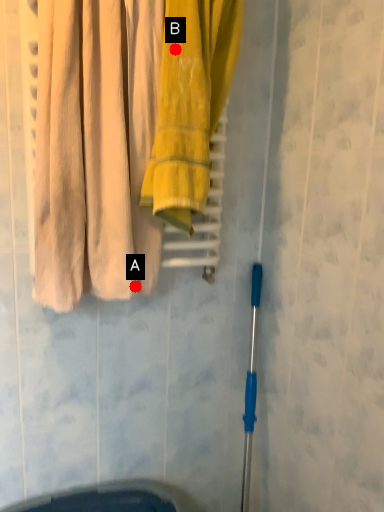
Question: Two points are circled on the image, labeled by A and B beside each circle. Which point is further to the camera?

Choices:
 (A) A is further
 (B) B is further

Answer: (A)